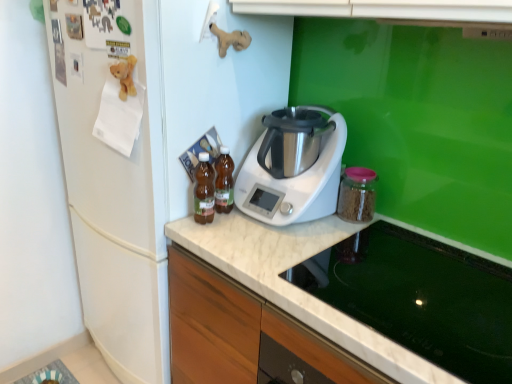
Question: Is glass stovetop at lower center inside or outside of white plastic appliance at center, which is counted as the 2th kitchen appliance, starting from the right?

Choices:
 (A) outside
 (B) inside

Answer: (A)

Question: Does point (439, 352) appear closer or farther from the camera than point (309, 200)?

Choices:
 (A) farther
 (B) closer

Answer: (B)

Question: Which object is the closest to the white plastic appliance at center, which is counted as the 2th kitchen appliance, starting from the right?

Choices:
 (A) white matte refrigerator at left
 (B) brown glass bottles at center, arranged as the 4th kitchen appliance when viewed from the right
 (C) glass stovetop at lower center
 (D) translucent glass bottles at center, acting as the 2th kitchen appliance starting from the left
 (E) transparent glass jar at right, the 4th kitchen appliance in the left-to-right sequence

Answer: (D)

Question: Which is nearer to the transparent glass jar at right, the 4th kitchen appliance in the left-to-right sequence?

Choices:
 (A) glass stovetop at lower center
 (B) translucent glass bottles at center, placed as the 3th kitchen appliance when sorted from right to left
 (C) brown glass bottles at center, arranged as the 4th kitchen appliance when viewed from the right
 (D) white matte refrigerator at left
 (E) white plastic appliance at center, which is the third kitchen appliance in left-to-right order

Answer: (E)